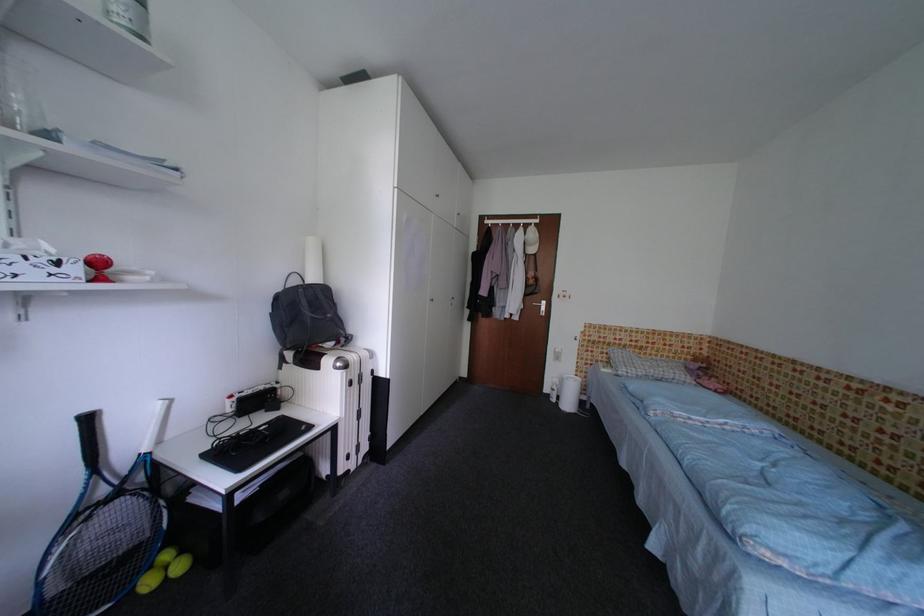
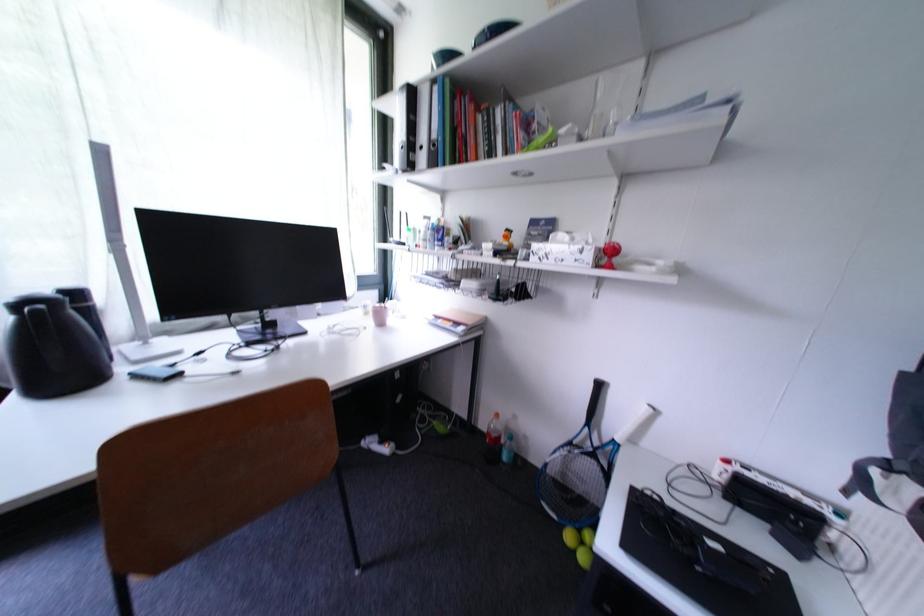
Find the pixel in the second image that matches point (175, 582) in the first image.

(582, 554)